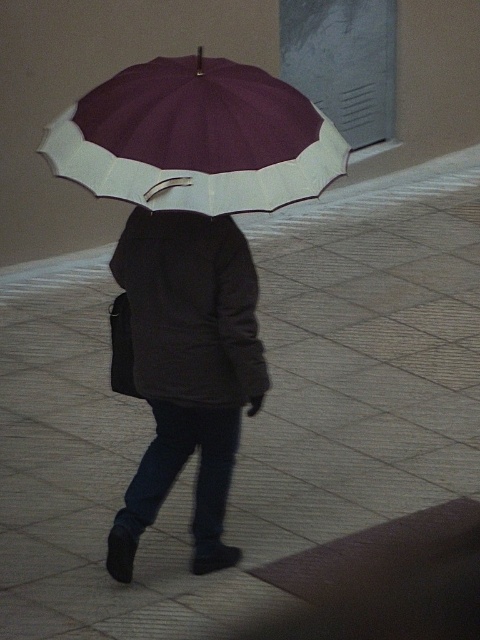
Based on the photo, you are standing in a dimly lit hallway with a tiled floor. You see a person wearing a dark gray fabric jacket at center holding a large maroon and white umbrella. There is a point at coordinates (188,369). Where is this point located?

The point at coordinates (188,369) is located on the dark gray fabric jacket at center.

You are standing in a dimly lit hallway and see a person wearing a dark gray fabric jacket at center walking away from you. If you want to catch up to them before they reach the end of the hallway, which is 20 feet away from your current position, can you do it if you run at a speed of 10 feet per second and they continue walking at 3 feet per second?

The dark gray fabric jacket at center is 12.76 feet away from you. The person is moving away at 3 feet per second while you can run at 10 feet per second. The distance to the hallway end is 20 feet. To catch them before they reach the end, calculate the time it takes for them to reach 20 feet from your position. Their remaining distance to the end is 20 feet minus their current distance of 12.76 feet, which is 7.24 feet. Time taken by them to reach the end is 7.24 ft divided by 3 ft per second, which is 2.4